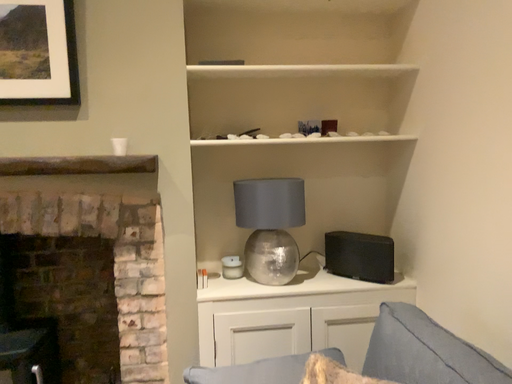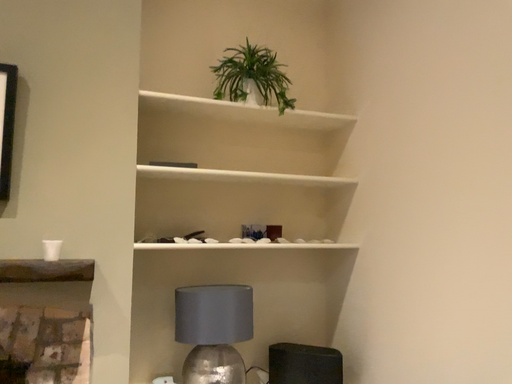
Question: Which way did the camera rotate in the video?

Choices:
 (A) rotated upward
 (B) rotated downward

Answer: (A)